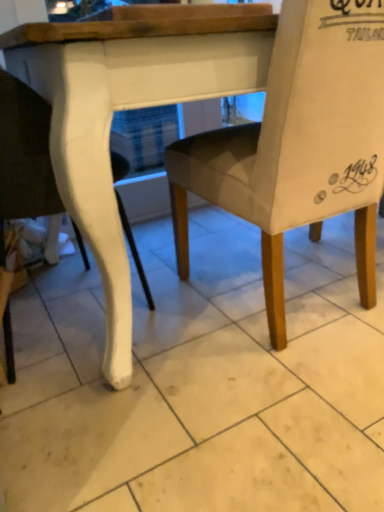
Image resolution: width=384 pixels, height=512 pixels. Find the location of `vacant area that is situated to the right of white glossy chair leg at left, which ranks as the 1th chair in left-to-right order`. vacant area that is situated to the right of white glossy chair leg at left, which ranks as the 1th chair in left-to-right order is located at coordinates (197, 331).